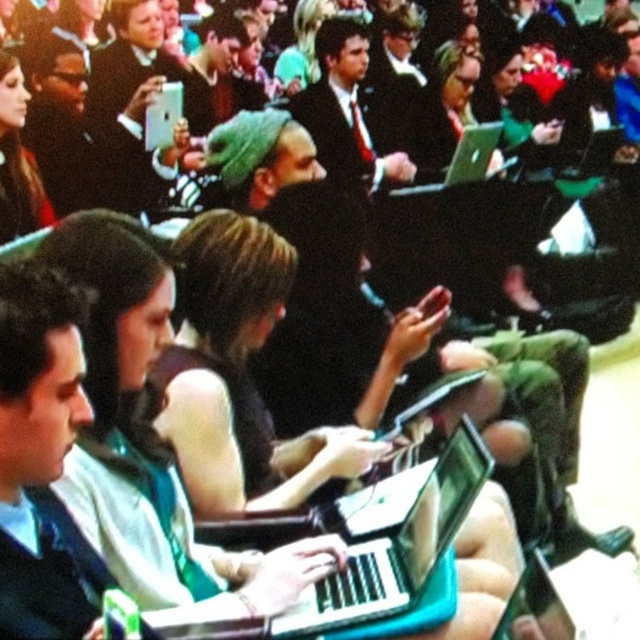
Consider the image. Which of these two, dark suit at center or silver metallic laptop at center, stands taller?

dark suit at center is taller.

Who is lower down, dark suit at center or silver metallic laptop at center?

silver metallic laptop at center is lower down.

Who is more forward, [321,150] or [481,138]?

Positioned in front is point [321,150].

The image size is (640, 640). What are the coordinates of `dark suit at center` in the screenshot? It's located at pyautogui.click(x=344, y=108).

Is matte black laptop at center shorter than matte black laptop at upper right?

No.

Between point (451, 465) and point (618, 134), which one is positioned behind?

Positioned behind is point (618, 134).

Where is `matte black laptop at center`? This screenshot has width=640, height=640. matte black laptop at center is located at coordinates (392, 538).

The image size is (640, 640). What do you see at coordinates (392, 538) in the screenshot?
I see `matte black laptop at center` at bounding box center [392, 538].

Is point (369, 513) positioned in front of point (406, 160)?

Yes, point (369, 513) is closer to viewer.

Where is `matte black laptop at center`? Image resolution: width=640 pixels, height=640 pixels. matte black laptop at center is located at coordinates (392, 538).